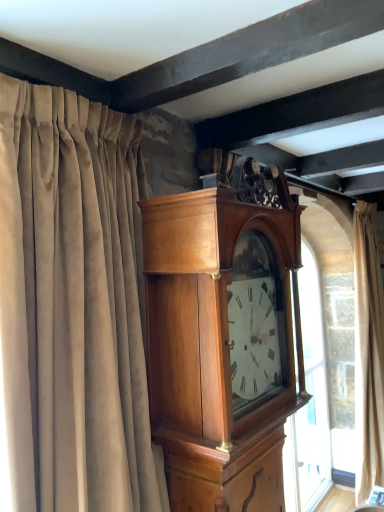
The height and width of the screenshot is (512, 384). I want to click on beige velvet curtain at right, arranged as the 2th curtain when viewed from the left, so click(368, 355).

The width and height of the screenshot is (384, 512). Identify the location of suede curtain at left, the second curtain viewed from the back. (73, 306).

Is suede curtain at left, acting as the 1th curtain starting from the front, surrounding beige velvet curtain at right, which ranks as the 2th curtain in front-to-back order?

No, beige velvet curtain at right, which ranks as the 2th curtain in front-to-back order, is located outside of suede curtain at left, acting as the 1th curtain starting from the front.

Is there a large distance between suede curtain at left, which ranks as the second curtain in right-to-left order, and beige velvet curtain at right, the first curtain positioned from the back?

Indeed, suede curtain at left, which ranks as the second curtain in right-to-left order, is not near beige velvet curtain at right, the first curtain positioned from the back.

Between point (80, 120) and point (361, 326), which one is positioned behind?

Point (361, 326)

In terms of width, does suede curtain at left, which ranks as the second curtain in right-to-left order, look wider or thinner when compared to beige velvet curtain at right, the first curtain positioned from the back?

Considering their sizes, suede curtain at left, which ranks as the second curtain in right-to-left order, looks broader than beige velvet curtain at right, the first curtain positioned from the back.

Would you say polished wood wall clock at center is a long distance from beige velvet curtain at right, arranged as the 2th curtain when viewed from the left?

polished wood wall clock at center is far away from beige velvet curtain at right, arranged as the 2th curtain when viewed from the left.

From the image's perspective, which object appears higher, polished wood wall clock at center or beige velvet curtain at right, placed as the 1th curtain when sorted from right to left?

From the image's view, polished wood wall clock at center is above.

Can you tell me how much polished wood wall clock at center and beige velvet curtain at right, placed as the 1th curtain when sorted from right to left, differ in facing direction?

They differ by 1.39 degrees in their facing directions.

Relative to polished wood wall clock at center, is beige velvet curtain at right, arranged as the 2th curtain when viewed from the left, in front or behind?

beige velvet curtain at right, arranged as the 2th curtain when viewed from the left, is behind polished wood wall clock at center.

Which object is thinner, beige velvet curtain at right, the first curtain positioned from the back, or polished wood wall clock at center?

beige velvet curtain at right, the first curtain positioned from the back, is thinner.

From the image's perspective, which one is positioned lower, beige velvet curtain at right, placed as the 1th curtain when sorted from right to left, or polished wood wall clock at center?

From the image's view, beige velvet curtain at right, placed as the 1th curtain when sorted from right to left, is below.

Considering the sizes of objects beige velvet curtain at right, the first curtain positioned from the back, and polished wood wall clock at center in the image provided, who is taller, beige velvet curtain at right, the first curtain positioned from the back, or polished wood wall clock at center?

With more height is beige velvet curtain at right, the first curtain positioned from the back.

Does polished wood wall clock at center have a lesser width compared to suede curtain at left, the second curtain viewed from the back?

Indeed, polished wood wall clock at center has a lesser width compared to suede curtain at left, the second curtain viewed from the back.

Which object is closer to the camera, polished wood wall clock at center or suede curtain at left, the second curtain viewed from the back?

suede curtain at left, the second curtain viewed from the back.

Is suede curtain at left, which ranks as the 1th curtain in left-to-right order, at the back of polished wood wall clock at center?

No.

Is polished wood wall clock at center far away from suede curtain at left, which ranks as the 1th curtain in left-to-right order?

polished wood wall clock at center is actually quite close to suede curtain at left, which ranks as the 1th curtain in left-to-right order.

Considering the relative positions of beige velvet curtain at right, placed as the 1th curtain when sorted from right to left, and suede curtain at left, which ranks as the 1th curtain in left-to-right order, in the image provided, is beige velvet curtain at right, placed as the 1th curtain when sorted from right to left, to the right of suede curtain at left, which ranks as the 1th curtain in left-to-right order, from the viewer's perspective?

Yes.

Between beige velvet curtain at right, placed as the 1th curtain when sorted from right to left, and suede curtain at left, which ranks as the 1th curtain in left-to-right order, which one has larger width?

Wider between the two is suede curtain at left, which ranks as the 1th curtain in left-to-right order.

Is beige velvet curtain at right, arranged as the 2th curtain when viewed from the left, directly adjacent to suede curtain at left, the second curtain viewed from the back?

No, beige velvet curtain at right, arranged as the 2th curtain when viewed from the left, is not making contact with suede curtain at left, the second curtain viewed from the back.

How much distance is there between beige velvet curtain at right, which ranks as the 2th curtain in front-to-back order, and suede curtain at left, the second curtain viewed from the back?

The distance of beige velvet curtain at right, which ranks as the 2th curtain in front-to-back order, from suede curtain at left, the second curtain viewed from the back, is 8.20 feet.

From a real-world perspective, relative to polished wood wall clock at center, is suede curtain at left, acting as the 1th curtain starting from the front, vertically above or below?

In terms of real-world spatial position, suede curtain at left, acting as the 1th curtain starting from the front, is above polished wood wall clock at center.

Locate an element on the screen. Image resolution: width=384 pixels, height=512 pixels. wall clock that is below the suede curtain at left, which ranks as the second curtain in right-to-left order (from the image's perspective) is located at coordinates (223, 336).

Is suede curtain at left, which ranks as the second curtain in right-to-left order, looking in the opposite direction of polished wood wall clock at center?

No.

Between point (131, 493) and point (261, 420), which one is positioned behind?

The point (261, 420) is farther from the camera.

You are a GUI agent. You are given a task and a screenshot of the screen. Output one action in this format:
    pyautogui.click(x=<x>, y=<y>)
    Task: Click on the curtain below the suede curtain at left, acting as the 1th curtain starting from the front (from a real-world perspective)
    The height and width of the screenshot is (512, 384).
    Given the screenshot: What is the action you would take?
    pyautogui.click(x=368, y=355)

Image resolution: width=384 pixels, height=512 pixels. Identify the location of curtain behind the polished wood wall clock at center. (368, 355).

From the image, which object appears to be farther from beige velvet curtain at right, placed as the 1th curtain when sorted from right to left, suede curtain at left, acting as the 1th curtain starting from the front, or polished wood wall clock at center?

suede curtain at left, acting as the 1th curtain starting from the front, is further to beige velvet curtain at right, placed as the 1th curtain when sorted from right to left.

Considering their positions, is suede curtain at left, the second curtain viewed from the back, positioned closer to polished wood wall clock at center than beige velvet curtain at right, placed as the 1th curtain when sorted from right to left?

suede curtain at left, the second curtain viewed from the back, is closer to polished wood wall clock at center.

Estimate the real-world distances between objects in this image. Which object is further from suede curtain at left, which ranks as the second curtain in right-to-left order, polished wood wall clock at center or beige velvet curtain at right, placed as the 1th curtain when sorted from right to left?

Based on the image, beige velvet curtain at right, placed as the 1th curtain when sorted from right to left, appears to be further to suede curtain at left, which ranks as the second curtain in right-to-left order.

From the image, which object appears to be nearer to suede curtain at left, which ranks as the 1th curtain in left-to-right order, beige velvet curtain at right, placed as the 1th curtain when sorted from right to left, or polished wood wall clock at center?

The object closer to suede curtain at left, which ranks as the 1th curtain in left-to-right order, is polished wood wall clock at center.

When comparing their distances from beige velvet curtain at right, arranged as the 2th curtain when viewed from the left, does polished wood wall clock at center or suede curtain at left, the second curtain viewed from the back, seem further?

suede curtain at left, the second curtain viewed from the back, lies further to beige velvet curtain at right, arranged as the 2th curtain when viewed from the left, than the other object.

When comparing their distances from polished wood wall clock at center, does beige velvet curtain at right, arranged as the 2th curtain when viewed from the left, or suede curtain at left, which ranks as the 1th curtain in left-to-right order, seem closer?

suede curtain at left, which ranks as the 1th curtain in left-to-right order, is closer to polished wood wall clock at center.

Where is `wall clock located between suede curtain at left, the second curtain viewed from the back, and beige velvet curtain at right, arranged as the 2th curtain when viewed from the left, in the depth direction`? wall clock located between suede curtain at left, the second curtain viewed from the back, and beige velvet curtain at right, arranged as the 2th curtain when viewed from the left, in the depth direction is located at coordinates (223, 336).